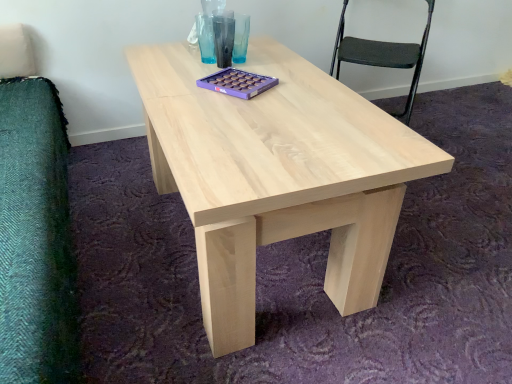
Question: Is natural wood coffee table at center at the back of black fabric chair at upper right?

Choices:
 (A) yes
 (B) no

Answer: (B)

Question: Is the depth of black fabric chair at upper right less than that of natural wood coffee table at center?

Choices:
 (A) yes
 (B) no

Answer: (B)

Question: From a real-world perspective, is black fabric chair at upper right located beneath natural wood coffee table at center?

Choices:
 (A) yes
 (B) no

Answer: (B)

Question: From a real-world perspective, is black fabric chair at upper right on natural wood coffee table at center?

Choices:
 (A) yes
 (B) no

Answer: (A)

Question: Considering the relative positions of black fabric chair at upper right and natural wood coffee table at center in the image provided, is black fabric chair at upper right to the right of natural wood coffee table at center from the viewer's perspective?

Choices:
 (A) yes
 (B) no

Answer: (B)

Question: Could you tell me if black fabric chair at upper right is facing natural wood coffee table at center?

Choices:
 (A) no
 (B) yes

Answer: (B)

Question: Is natural wood coffee table at center touching black fabric chair at upper right?

Choices:
 (A) no
 (B) yes

Answer: (A)

Question: Considering the relative sizes of natural wood coffee table at center and black fabric chair at upper right in the image provided, is natural wood coffee table at center shorter than black fabric chair at upper right?

Choices:
 (A) no
 (B) yes

Answer: (B)

Question: Could you tell me if natural wood coffee table at center is turned towards black fabric chair at upper right?

Choices:
 (A) no
 (B) yes

Answer: (A)

Question: From a real-world perspective, is natural wood coffee table at center over black fabric chair at upper right?

Choices:
 (A) no
 (B) yes

Answer: (A)

Question: Is natural wood coffee table at center at the left side of black fabric chair at upper right?

Choices:
 (A) yes
 (B) no

Answer: (B)

Question: Can black fabric chair at upper right be found inside natural wood coffee table at center?

Choices:
 (A) no
 (B) yes

Answer: (A)

Question: Considering the positions of natural wood coffee table at center and black fabric chair at upper right in the image, is natural wood coffee table at center taller or shorter than black fabric chair at upper right?

Choices:
 (A) tall
 (B) short

Answer: (B)